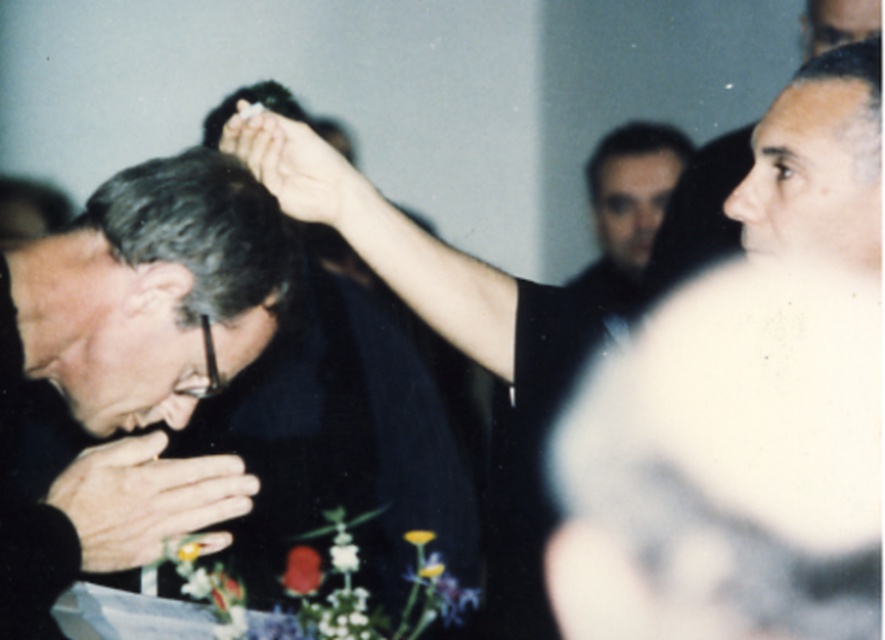
Is gray matte hair at upper right thinner than smooth black hair at center?

Yes, gray matte hair at upper right is thinner than smooth black hair at center.

Consider the image. Is gray matte hair at upper right further to the viewer compared to smooth black hair at center?

No, gray matte hair at upper right is closer to the viewer.

Measure the distance between gray matte hair at upper right and camera.

3.43 feet

The width and height of the screenshot is (885, 640). I want to click on gray matte hair at upper right, so click(x=817, y=163).

Can you confirm if white matte flowers at lower center is positioned to the left of smooth skin hand at center?

Incorrect, white matte flowers at lower center is not on the left side of smooth skin hand at center.

Is white matte flowers at lower center wider than smooth skin hand at center?

Correct, the width of white matte flowers at lower center exceeds that of smooth skin hand at center.

Who is more distant from viewer, [224,584] or [283,179]?

Positioned behind is point [224,584].

This screenshot has height=640, width=885. Find the location of `white matte flowers at lower center`. white matte flowers at lower center is located at coordinates (366, 589).

Is gray matte hair at upper right bigger than white matte flower at center?

Yes.

Based on the photo, can you confirm if gray matte hair at upper right is wider than white matte flower at center?

Indeed, gray matte hair at upper right has a greater width compared to white matte flower at center.

The image size is (885, 640). What are the coordinates of `gray matte hair at upper right` in the screenshot? It's located at (817, 163).

Identify the location of gray matte hair at upper right. Image resolution: width=885 pixels, height=640 pixels. (817, 163).